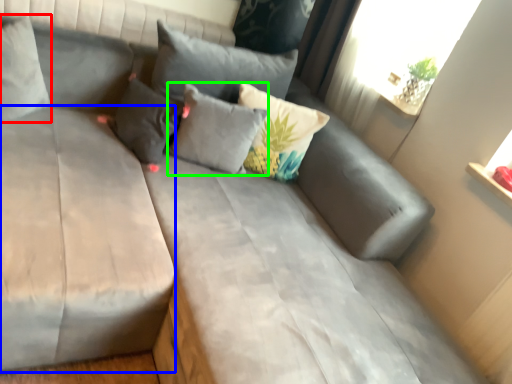
Question: Based on their relative distances, which object is farther from pillow (highlighted by a red box)? Choose from mattress (highlighted by a blue box) and pillow (highlighted by a green box).

Choices:
 (A) mattress
 (B) pillow

Answer: (B)